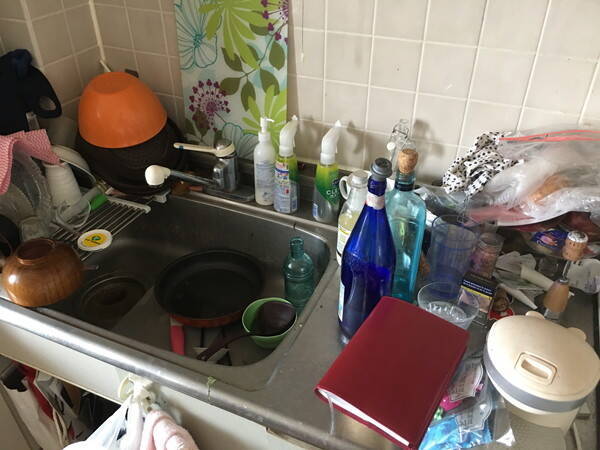
Image resolution: width=600 pixels, height=450 pixels. In order to click on bottle in this screenshot , I will do `click(381, 249)`.